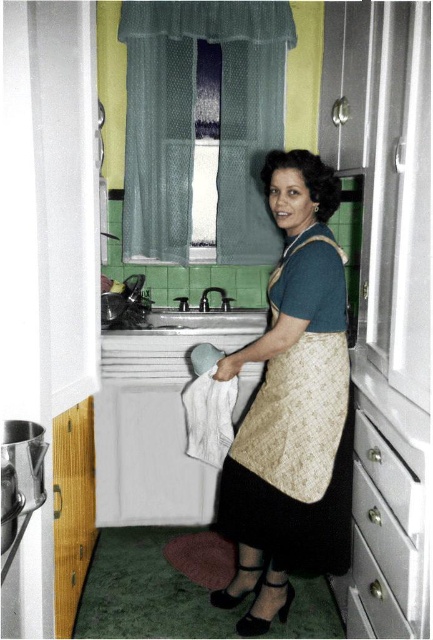
Question: Which object appears farthest from the camera in this image?

Choices:
 (A) matte gold apron at center
 (B) metallic silver drawer at lower right

Answer: (A)

Question: Does matte gold apron at center have a greater width compared to metallic silver drawer at lower right?

Choices:
 (A) no
 (B) yes

Answer: (B)

Question: Observing the image, what is the correct spatial positioning of matte gold apron at center in reference to metallic silver drawer at lower right?

Choices:
 (A) right
 (B) left

Answer: (B)

Question: Which object is farther from the camera taking this photo?

Choices:
 (A) matte gold apron at center
 (B) metallic silver drawer at lower right

Answer: (A)

Question: Where is matte gold apron at center located in relation to metallic silver drawer at lower right in the image?

Choices:
 (A) right
 (B) left

Answer: (B)